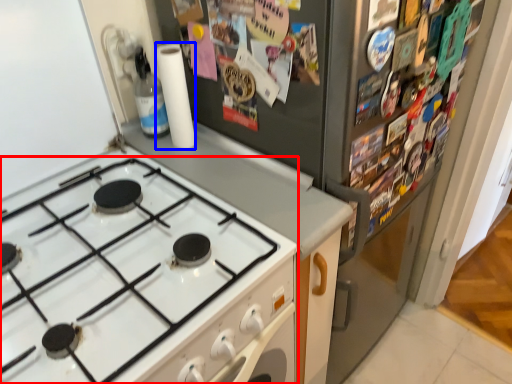
Question: Which object is further to the camera taking this photo, gas stove (highlighted by a red box) or paper towel (highlighted by a blue box)?

Choices:
 (A) gas stove
 (B) paper towel

Answer: (B)